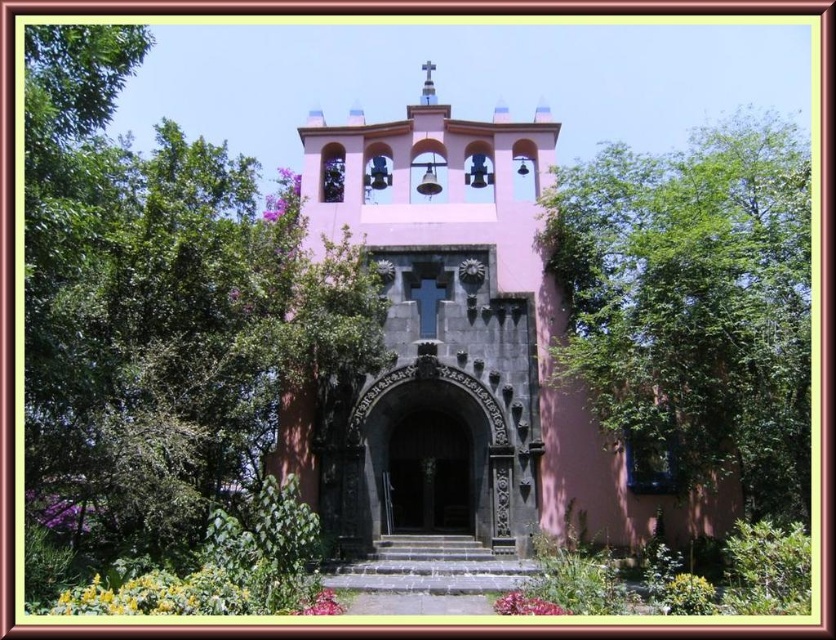
You are standing in front of the pink church and want to know how far the point at coordinates point (90,120) is from you. Can you determine the distance?

The point (90,120) is 62.85 meters away from the viewer.

You are standing in front of the pink matte church at center and want to take a photo of the green leafy tree at center. In which direction should you move to get the tree in your camera frame?

The green leafy tree at center is positioned on the left side of pink matte church at center, so you should move to the left to get the tree in your camera frame.